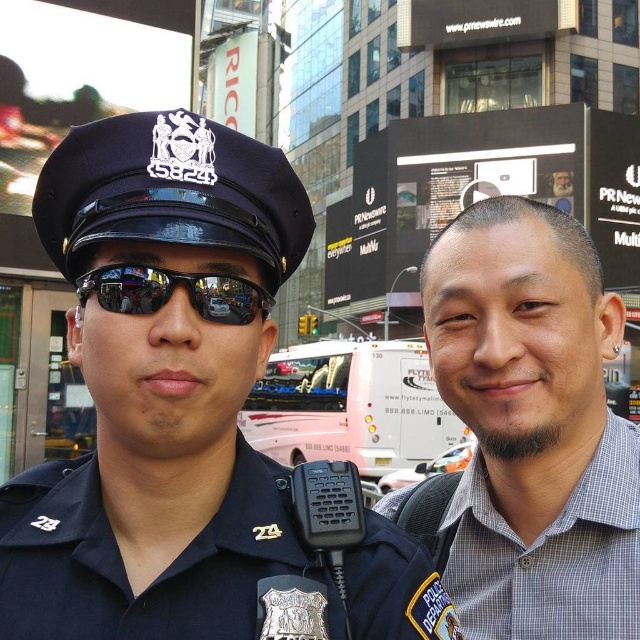
In the scene shown: Does dark blue fabric police uniform at center lie behind sunglasses at center?

No, dark blue fabric police uniform at center is in front of sunglasses at center.

Locate an element on the screen. The width and height of the screenshot is (640, 640). dark blue fabric police uniform at center is located at coordinates (204, 568).

Can you confirm if blue uniform at left is positioned below sunglasses at center?

Yes, blue uniform at left is below sunglasses at center.

Does blue uniform at left have a greater width compared to sunglasses at center?

No.

Between point (212, 310) and point (170, 275), which one is positioned in front?

Positioned in front is point (170, 275).

Locate an element on the screen. blue uniform at left is located at coordinates point(182,410).

Is gray checkered shirt at right below dark blue fabric police uniform at center?

Actually, gray checkered shirt at right is above dark blue fabric police uniform at center.

Is point (611, 577) more distant than point (246, 522)?

Yes, point (611, 577) is farther from viewer.

Which is behind, point (568, 538) or point (81, 612)?

Point (568, 538)

This screenshot has height=640, width=640. In order to click on gray checkered shirt at right in this screenshot , I will do `click(532, 426)`.